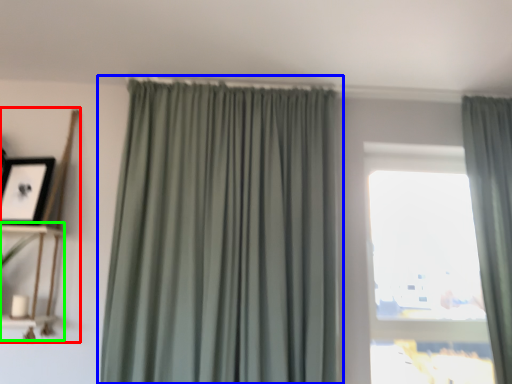
Question: Which is farther away from shelf (highlighted by a red box)? curtain (highlighted by a blue box) or shelf (highlighted by a green box)?

Choices:
 (A) curtain
 (B) shelf

Answer: (A)